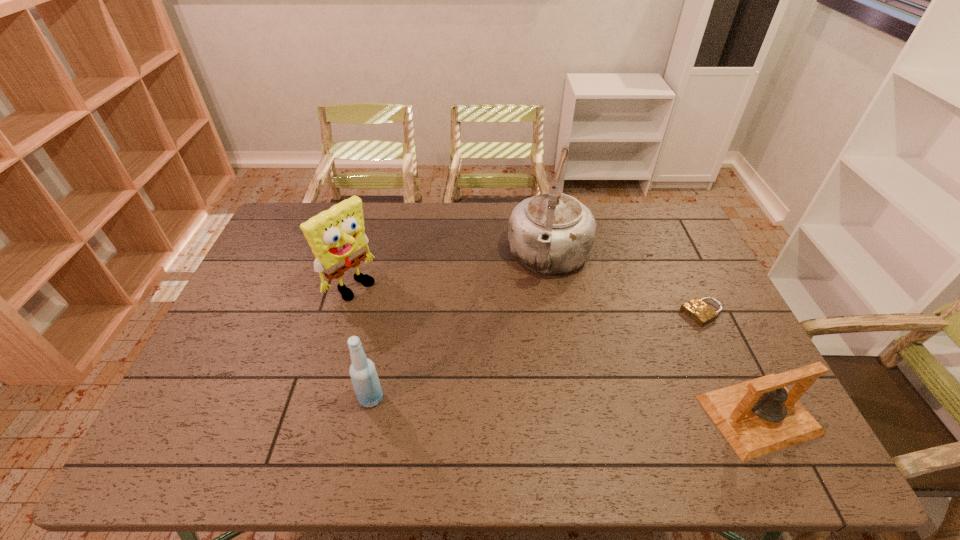
Locate an element on the screen. bottle is located at coordinates (363, 374).

Where is `the second object from left to right`? This screenshot has height=540, width=960. the second object from left to right is located at coordinates (363, 374).

Find the location of a particular element. bell is located at coordinates 759,416.

Where is `the third object from left to right`? Image resolution: width=960 pixels, height=540 pixels. the third object from left to right is located at coordinates (552, 233).

Where is `the tallest object`? the tallest object is located at coordinates (552, 233).

At what (x,y) coordinates should I click in order to perform the action: click on the leftmost object. Please return your answer as a coordinate pair (x, y). Looking at the image, I should click on (337, 238).

Image resolution: width=960 pixels, height=540 pixels. What are the coordinates of `sponge` in the screenshot? It's located at (337, 238).

Identify the location of padlock. (697, 310).

The image size is (960, 540). In order to click on vacant space located on the right of the bottle in this screenshot , I will do `click(426, 398)`.

Find the location of a particular element. vacant space located on the left of the fourth tallest object is located at coordinates (588, 415).